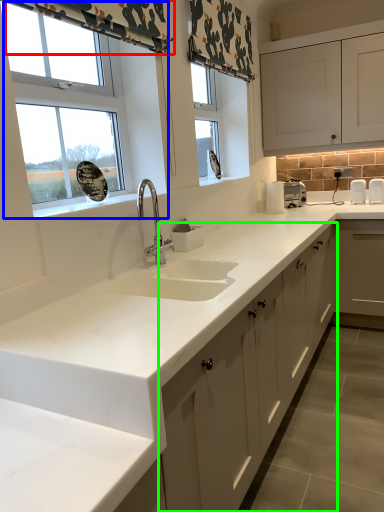
Question: Based on their relative distances, which object is farther from curtain (highlighted by a red box)? Choose from window (highlighted by a blue box) and cabinetry (highlighted by a green box).

Choices:
 (A) window
 (B) cabinetry

Answer: (B)